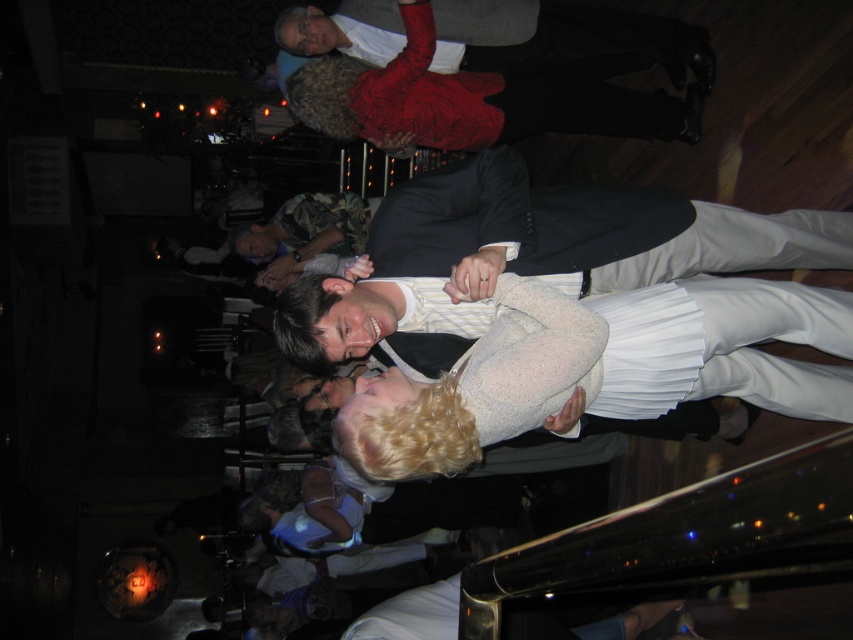
Question: Which point is closer to the camera?

Choices:
 (A) (657, 28)
 (B) (779, 305)

Answer: (B)

Question: Among these points, which one is farthest from the camera?

Choices:
 (A) (633, 376)
 (B) (483, 49)

Answer: (B)

Question: Can you confirm if white pleated dress at center is positioned above matte white shirt at upper center?

Choices:
 (A) yes
 (B) no

Answer: (B)

Question: Is white pleated dress at center below matte white shirt at upper center?

Choices:
 (A) no
 (B) yes

Answer: (B)

Question: Is white pleated dress at center further to camera compared to matte white shirt at upper center?

Choices:
 (A) no
 (B) yes

Answer: (A)